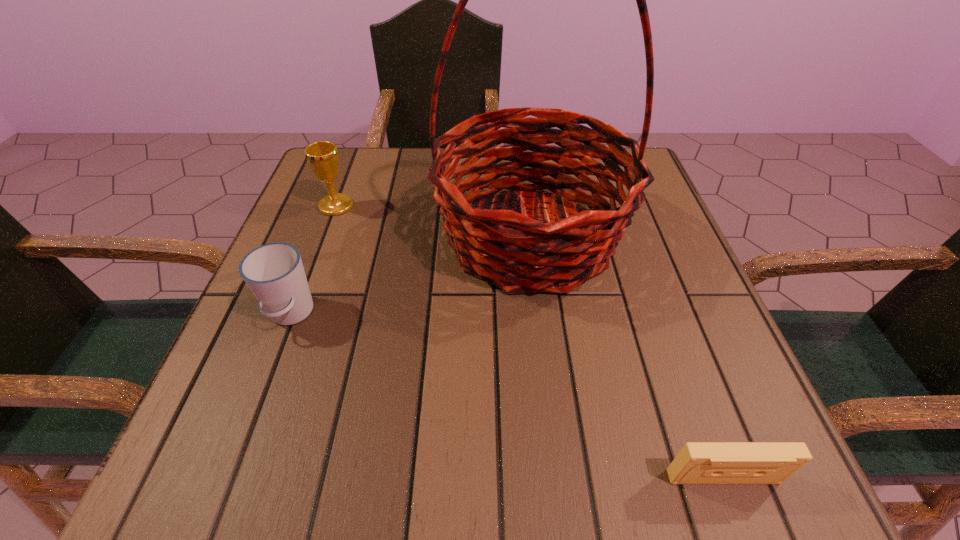
The height and width of the screenshot is (540, 960). I want to click on vacant area at the left edge, so click(266, 364).

In the image, there is a desktop. Where is `vacant region at the right edge`? The image size is (960, 540). vacant region at the right edge is located at coordinates (665, 251).

The height and width of the screenshot is (540, 960). I want to click on vacant area at the far left corner, so click(x=361, y=158).

Where is `vacant area that lies between the chalice and the third tallest object`? vacant area that lies between the chalice and the third tallest object is located at coordinates (314, 260).

This screenshot has height=540, width=960. In order to click on empty space that is in between the third shortest object and the basket in this screenshot , I will do `click(433, 221)`.

The image size is (960, 540). In order to click on free spot between the shortest object and the cup in this screenshot , I will do `click(507, 396)`.

At what (x,y) coordinates should I click in order to perform the action: click on free space between the videotape and the cup. Please return your answer as a coordinate pair (x, y). Image resolution: width=960 pixels, height=540 pixels. Looking at the image, I should click on (507, 396).

The height and width of the screenshot is (540, 960). Identify the location of free spot between the third shortest object and the basket. (433, 221).

The height and width of the screenshot is (540, 960). Find the location of `unoccupied position between the tallest object and the second tallest object`. unoccupied position between the tallest object and the second tallest object is located at coordinates (433, 221).

Locate an element on the screen. The width and height of the screenshot is (960, 540). free point between the basket and the third tallest object is located at coordinates (410, 275).